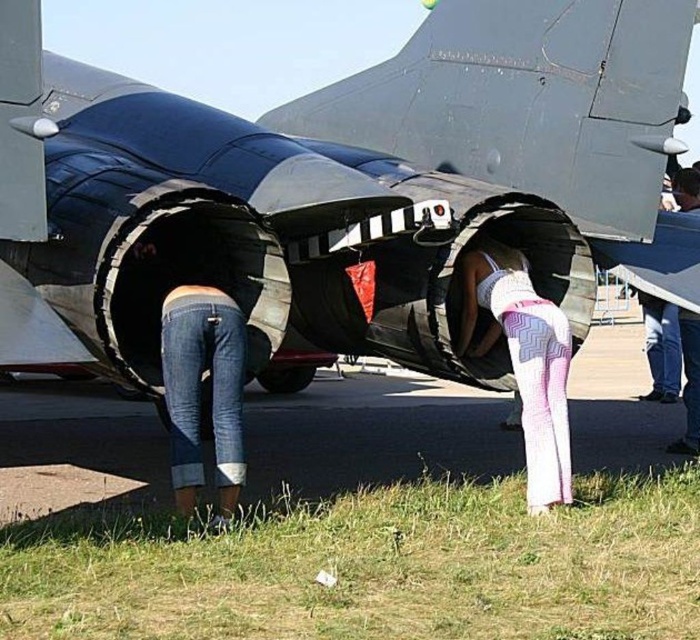
You are a maintenance worker standing on the black asphalt at lower center and need to reach the metallic gray jet engine at center for inspection. Can you step onto the engine from your current position without needing a ladder?

The metallic gray jet engine at center is taller than black asphalt at lower center, so you would need a ladder or some form of elevation to reach it from the black asphalt at lower center.

You are standing at the point marked as point (372, 433). What is the material under your feet?

The material under your feet is black asphalt at lower center.